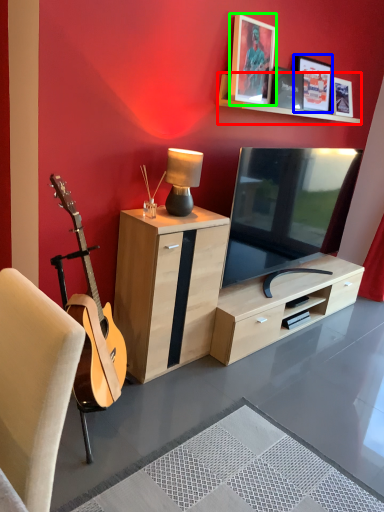
Question: Which is nearer to the shelf (highlighted by a red box)? picture frame (highlighted by a blue box) or picture frame (highlighted by a green box).

Choices:
 (A) picture frame
 (B) picture frame

Answer: (B)